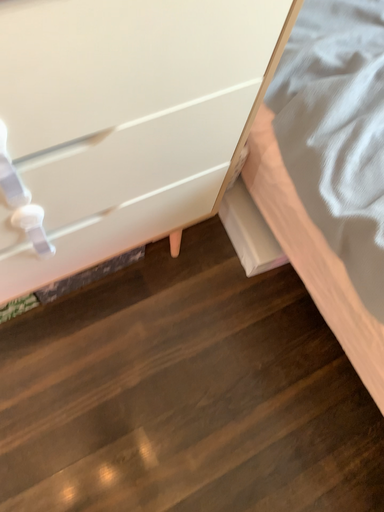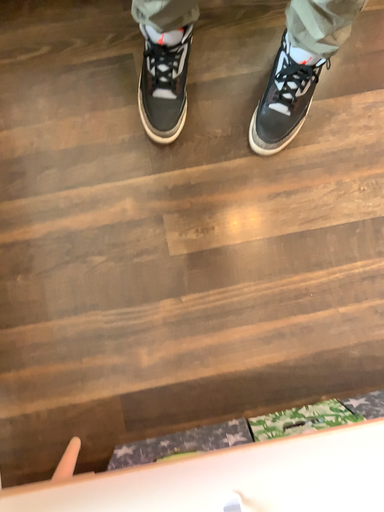
Question: Which way did the camera rotate in the video?

Choices:
 (A) rotated right
 (B) rotated left

Answer: (A)